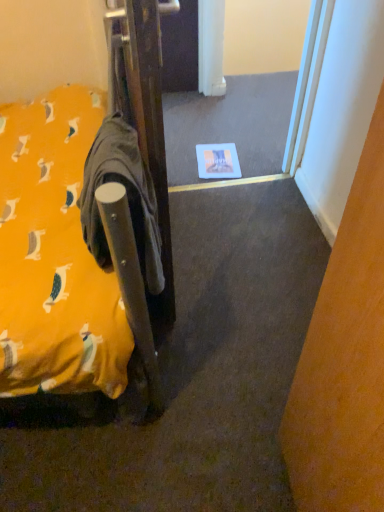
Measure the distance between point (100, 155) and camera.

A distance of 82.50 centimeters exists between point (100, 155) and camera.

Locate an element on the screen. This screenshot has height=512, width=384. gray cotton robe at left is located at coordinates (127, 195).

What do you see at coordinates (127, 195) in the screenshot? I see `gray cotton robe at left` at bounding box center [127, 195].

In order to click on gray cotton robe at left in this screenshot , I will do `click(127, 195)`.